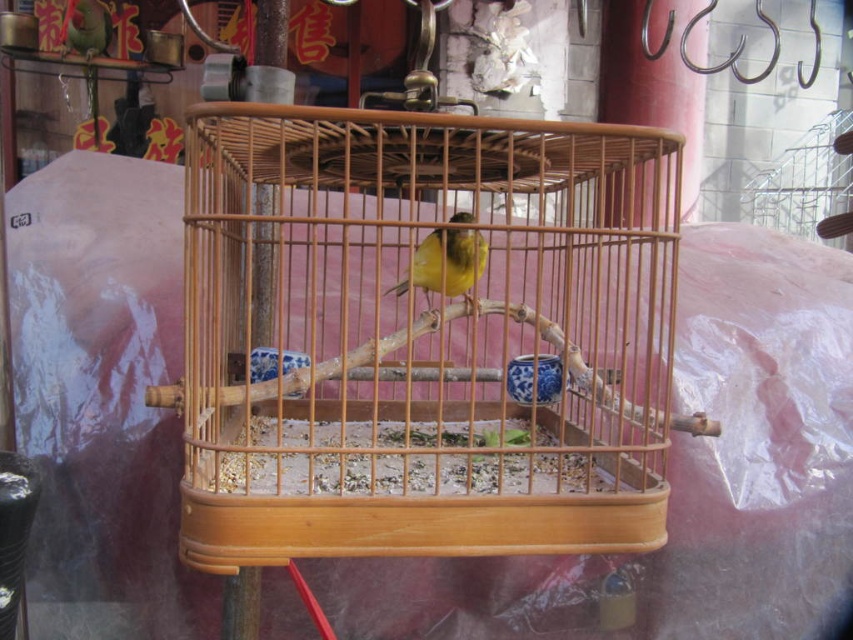
What do you see at coordinates (422, 336) in the screenshot? I see `wooden birdcage at center` at bounding box center [422, 336].

Can you confirm if wooden birdcage at center is wider than yellow matte canary at center?

Indeed, wooden birdcage at center has a greater width compared to yellow matte canary at center.

Who is more forward, (364, 364) or (416, 278)?

Positioned in front is point (364, 364).

This screenshot has width=853, height=640. I want to click on wooden birdcage at center, so click(x=422, y=336).